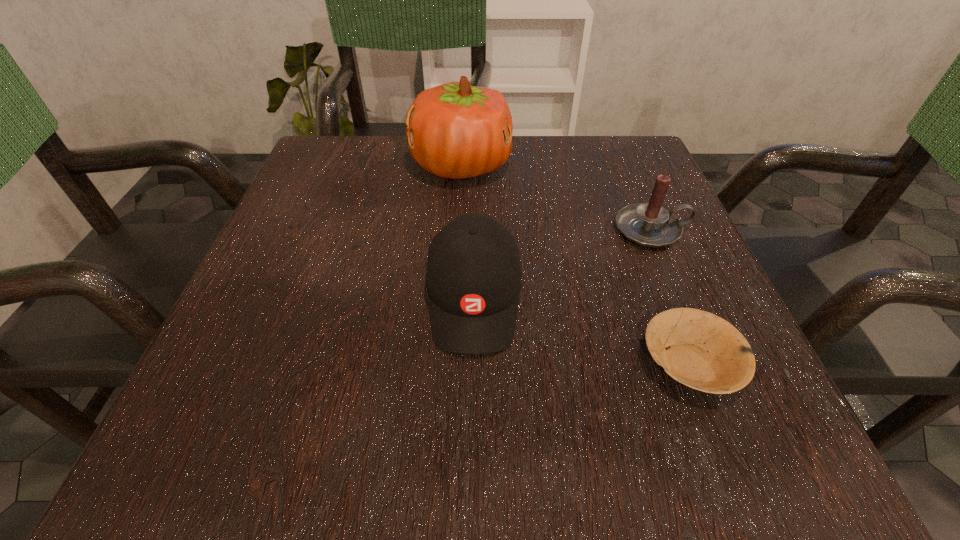
Locate an element on the screen. candle located in the right edge section of the desktop is located at coordinates (649, 224).

In order to click on bowl situated at the right edge in this screenshot , I will do `click(703, 351)`.

The width and height of the screenshot is (960, 540). Identify the location of object that is at the near right corner. (703, 351).

Identify the location of free space at the far edge of the desktop. (580, 186).

Locate an element on the screen. free space at the near edge is located at coordinates (562, 422).

Identify the location of vacant space at the left edge of the desktop. (336, 264).

What are the coordinates of `vacant space at the right edge of the desktop` in the screenshot? It's located at (626, 244).

Find the location of a particular element. vacant space at the far left corner of the desktop is located at coordinates (341, 145).

Where is `free space at the near left corner of the desktop`? The height and width of the screenshot is (540, 960). free space at the near left corner of the desktop is located at coordinates (235, 426).

In order to click on free space at the far right corner of the desktop in this screenshot , I will do pos(582,139).